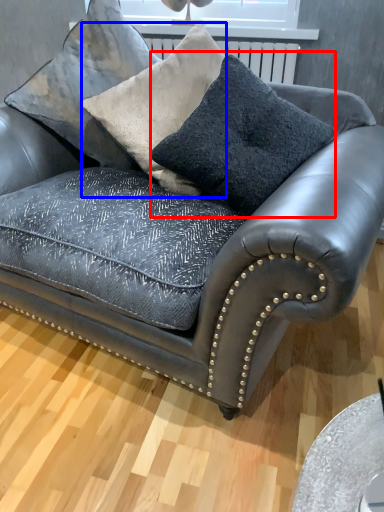
Question: Which object appears farthest to the camera in this image, throw pillow (highlighted by a red box) or throw pillow (highlighted by a blue box)?

Choices:
 (A) throw pillow
 (B) throw pillow

Answer: (B)